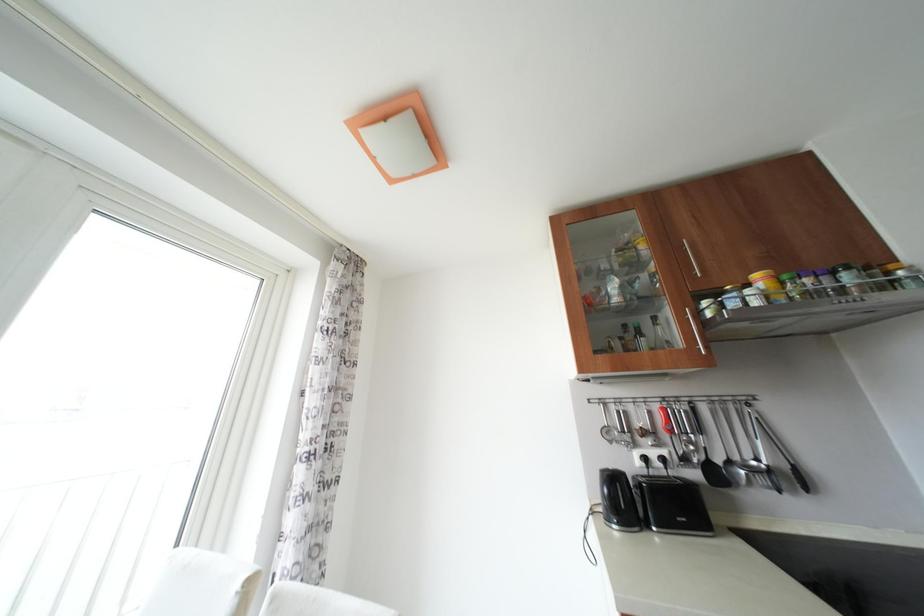
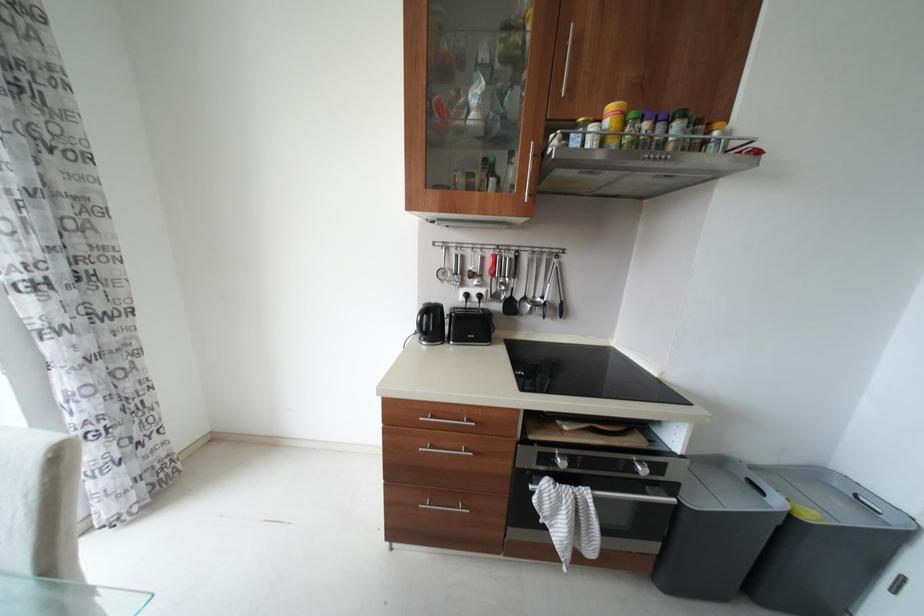
The images are taken continuously from a first-person perspective. In which direction is your viewpoint rotating?

The camera's rotation is toward right-down.